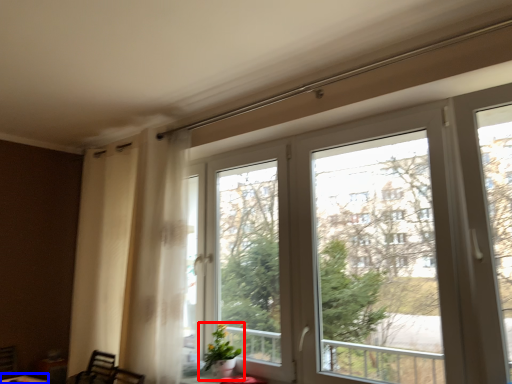
Question: Which object is closer to the camera taking this photo, houseplant (highlighted by a red box) or round table (highlighted by a blue box)?

Choices:
 (A) houseplant
 (B) round table

Answer: (A)